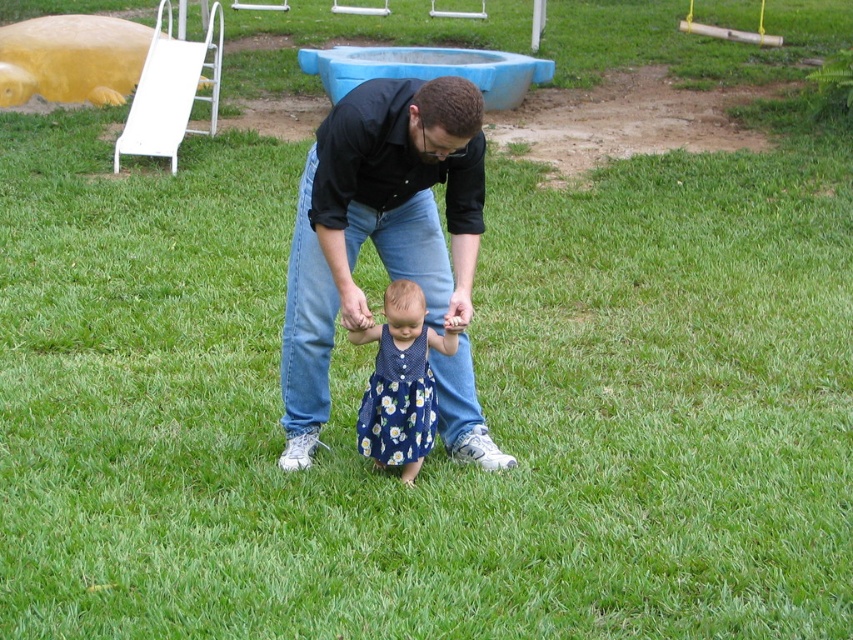
In the scene shown: You are standing in the park and see two points marked in the image. Which point is closer to you, point (315, 419) or point (390, 300)?

Point (315, 419) is closer to you than point (390, 300) because it is further to the viewer.

From the picture: You are a photographer trying to capture a candid shot of the man and child. Since the black cotton shirt at center and the blue floral dress at center are both in the frame, which clothing item is covering part of the other?

The black cotton shirt at center is positioned over the blue floral dress at center, so it is covering part of it.

From the picture: You are a photographer trying to capture the man and child in the scene. You want to ensure the black cotton shirt at center is visible in the photo. Where should you position yourself relative to the point at coordinates (376, 225)?

The black cotton shirt at center is located at point (376, 225), so positioning yourself directly at that point would ensure the shirt is visible in the photo.